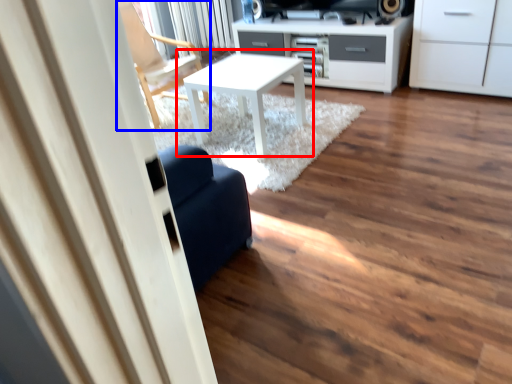
Question: Among these objects, which one is nearest to the camera, table (highlighted by a red box) or chair (highlighted by a blue box)?

Choices:
 (A) table
 (B) chair

Answer: (A)